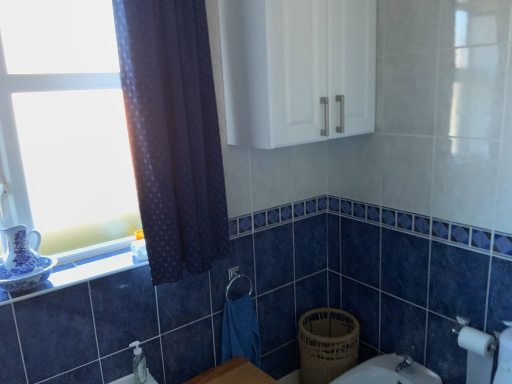
Where is `vacant area on top of white glossy window sill at lower left (from a real-world perspective)`? The image size is (512, 384). vacant area on top of white glossy window sill at lower left (from a real-world perspective) is located at coordinates (98, 260).